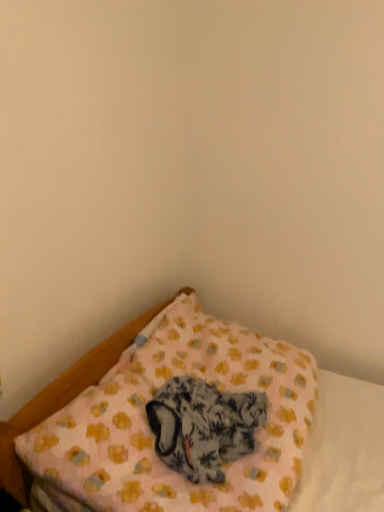
Question: From a real-world perspective, is fluffy fabric cat at lower center above or below pink fabric pillow at lower center?

Choices:
 (A) above
 (B) below

Answer: (A)

Question: Is fluffy fabric cat at lower center taller or shorter than pink fabric pillow at lower center?

Choices:
 (A) short
 (B) tall

Answer: (A)

Question: Looking at their shapes, would you say fluffy fabric cat at lower center is wider or thinner than pink fabric pillow at lower center?

Choices:
 (A) wide
 (B) thin

Answer: (B)

Question: From the image's perspective, relative to fluffy fabric cat at lower center, is pink fabric pillow at lower center above or below?

Choices:
 (A) below
 (B) above

Answer: (B)

Question: Would you say pink fabric pillow at lower center is to the left or to the right of fluffy fabric cat at lower center in the picture?

Choices:
 (A) right
 (B) left

Answer: (A)

Question: Is point (71, 474) closer or farther from the camera than point (175, 397)?

Choices:
 (A) farther
 (B) closer

Answer: (B)

Question: Is pink fabric pillow at lower center inside the boundaries of fluffy fabric cat at lower center, or outside?

Choices:
 (A) outside
 (B) inside

Answer: (A)